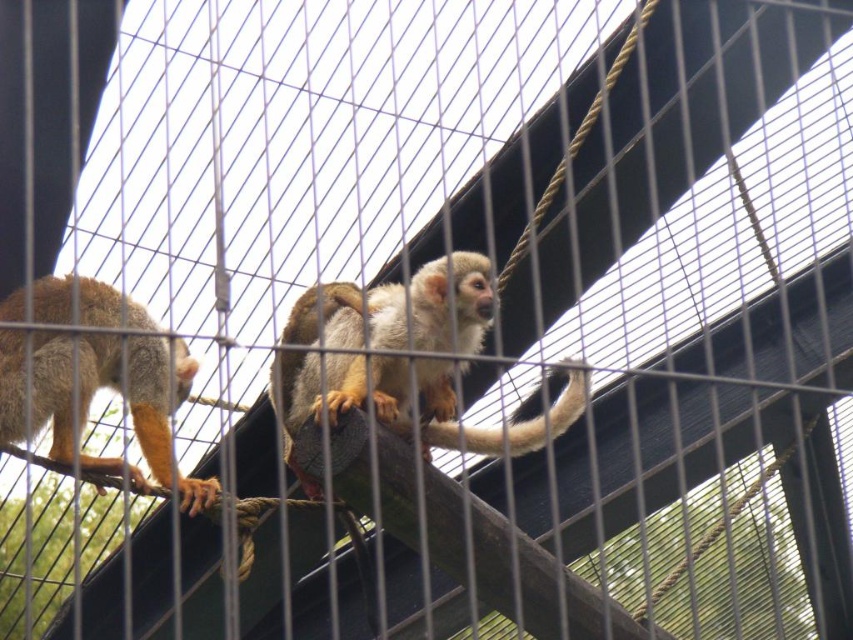
Question: Can you confirm if golden fur monkey at center is positioned below fuzzy brown tail at center?

Choices:
 (A) yes
 (B) no

Answer: (B)

Question: Among these objects, which one is nearest to the camera?

Choices:
 (A) fuzzy brown tail at center
 (B) golden fur monkey at center

Answer: (A)

Question: Among these objects, which one is farthest from the camera?

Choices:
 (A) fuzzy brown tail at center
 (B) golden fur monkey at center
 (C) brown fur monkey at left

Answer: (C)

Question: In this image, where is brown fur monkey at left located relative to fuzzy brown tail at center?

Choices:
 (A) left
 (B) right

Answer: (A)

Question: Which object is closer to the camera taking this photo?

Choices:
 (A) brown fur monkey at left
 (B) golden fur monkey at center
 (C) fuzzy brown tail at center

Answer: (C)

Question: In this image, where is brown fur monkey at left located relative to fuzzy brown tail at center?

Choices:
 (A) right
 (B) left

Answer: (B)